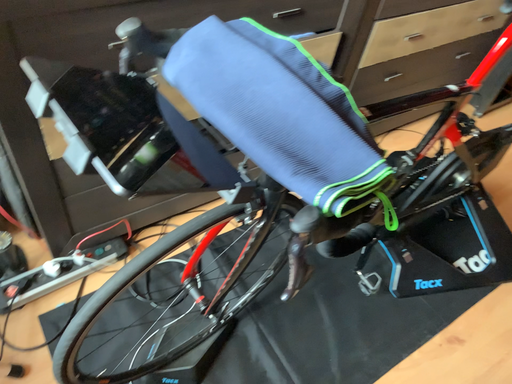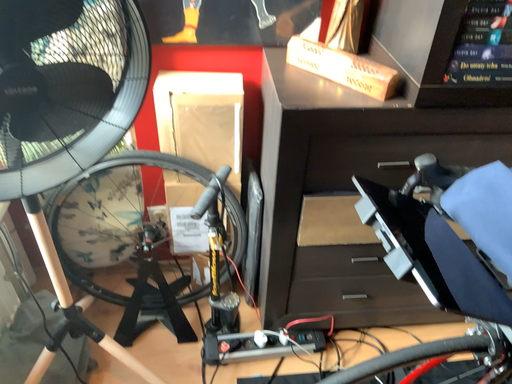
Question: Which way did the camera rotate in the video?

Choices:
 (A) rotated left
 (B) rotated right

Answer: (A)